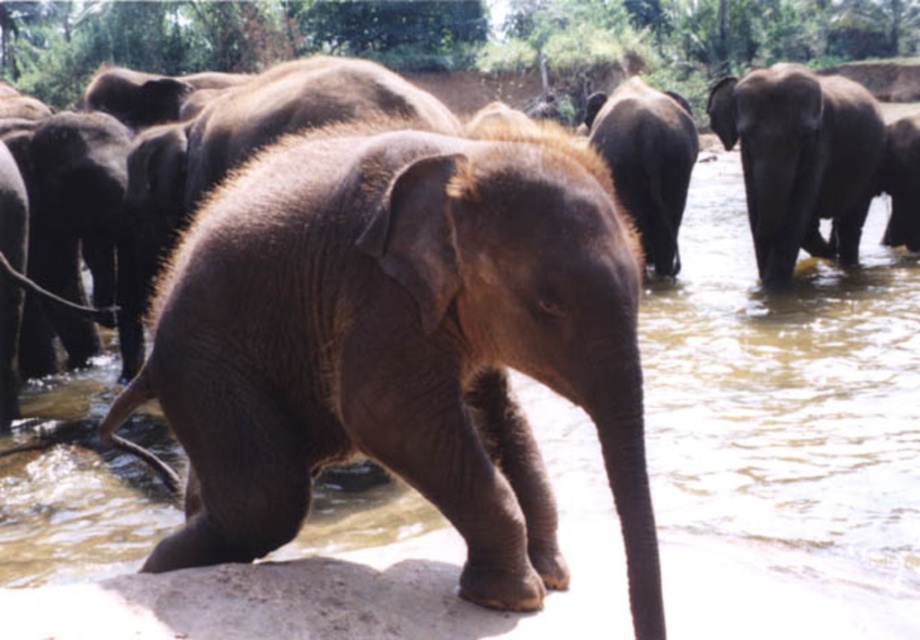
Question: Does dark brown wrinkled elephant at right have a lesser width compared to grayish-brown textured elephant at right?

Choices:
 (A) yes
 (B) no

Answer: (B)

Question: Does smooth brown elephant at center come in front of grayish-brown textured elephant at right?

Choices:
 (A) no
 (B) yes

Answer: (B)

Question: Which of these objects is positioned farthest from the smooth brown elephant at center?

Choices:
 (A) grayish-brown textured elephant at right
 (B) dark brown wrinkled elephant at center
 (C) dark brown wrinkled elephant at right

Answer: (A)

Question: Which object appears farthest from the camera in this image?

Choices:
 (A) grayish-brown textured elephant at right
 (B) dark brown wrinkled elephant at right
 (C) dark brown wrinkled elephant at center

Answer: (A)

Question: Which object appears closest to the camera in this image?

Choices:
 (A) smooth brown elephant at center
 (B) grayish-brown textured elephant at right

Answer: (A)

Question: Is dark brown wrinkled elephant at center to the left of grayish-brown textured elephant at right from the viewer's perspective?

Choices:
 (A) yes
 (B) no

Answer: (A)